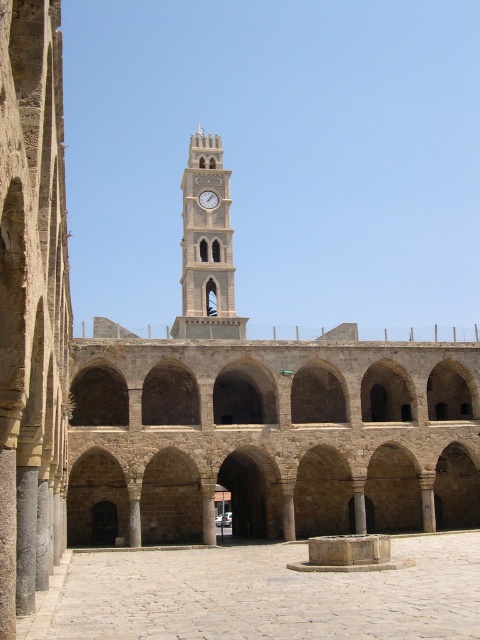
In the scene shown: You are a tourist standing at the edge of the courtyard. You want to take a photo of both the smooth stone fountain at center and the metallic clock at center in the same frame. Given that your camera has a maximum focal length that allows capturing objects up to 100 meters apart in the same shot, will you be able to include both in your photo?

The smooth stone fountain at center is 98.10 meters from the metallic clock at center. Since the distance between them is within the camera maximum focal length of 100 meters, you can include both in the same photo.

From the picture: You are standing in the courtyard looking towards the white stone clock tower at center. Based on its 2D coordinates, how would you describe its position relative to the courtyard?

The white stone clock tower at center is positioned at coordinates approximately 0.388 on the x axis and 0.431 on the y axis, meaning it is slightly to the left of the center horizontally and slightly below the center vertically within the courtyard.

You are standing in the courtyard of the historical building and want to walk from the fountain to the base of the clock tower. There are two points marked on your map labeled as point (x=327, y=573) and point (x=227, y=272). Which point should you head towards first to reach the base of the clock tower?

You should head towards point (x=227, y=272) first because point (x=327, y=573) is in front of point (x=227, y=272), meaning point (x=227, y=272) is closer to the base of the clock tower.